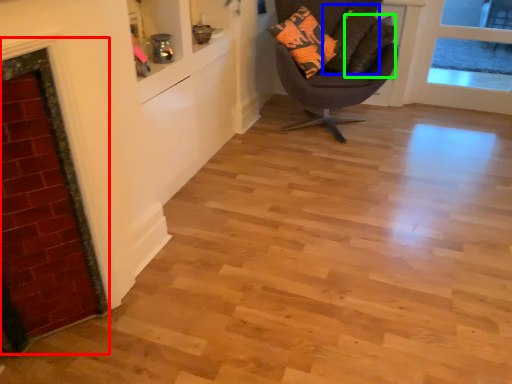
Question: Based on their relative distances, which object is farther from fireplace (highlighted by a red box)? Choose from pillow (highlighted by a blue box) and pillow (highlighted by a green box).

Choices:
 (A) pillow
 (B) pillow

Answer: (A)